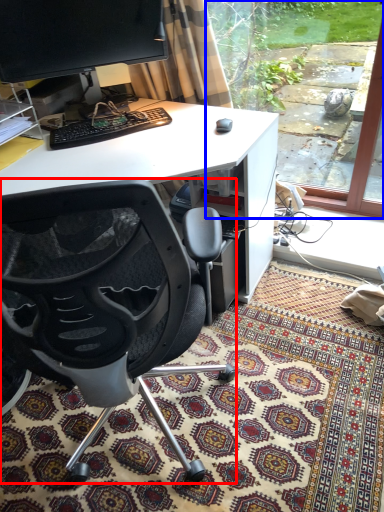
Question: Among these objects, which one is farthest to the camera, chair (highlighted by a red box) or window screen (highlighted by a blue box)?

Choices:
 (A) chair
 (B) window screen

Answer: (B)